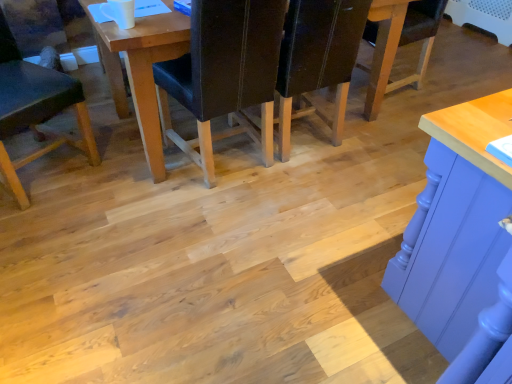
Locate an element on the screen. This screenshot has height=384, width=512. vacant area that is in front of wooden table at center is located at coordinates (226, 254).